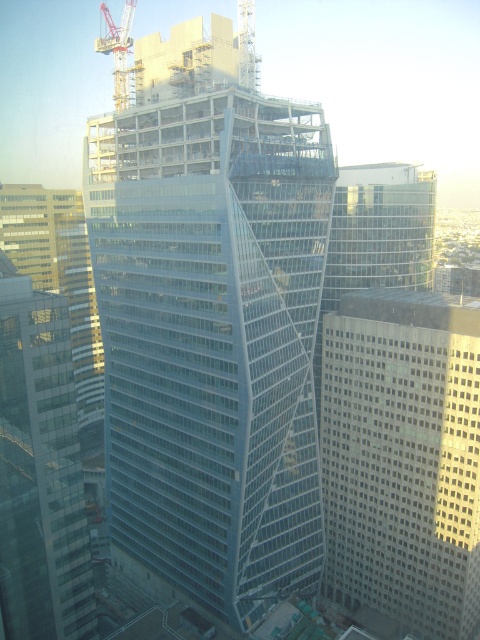
Who is lower down, glassy steel skyscraper at center or metallic yellow crane at upper left?

glassy steel skyscraper at center

The height and width of the screenshot is (640, 480). What do you see at coordinates (212, 333) in the screenshot?
I see `glassy steel skyscraper at center` at bounding box center [212, 333].

This screenshot has height=640, width=480. Identify the location of glassy steel skyscraper at center. (212, 333).

Which is below, clear glass skyscraper at left or metallic yellow crane at upper left?

clear glass skyscraper at left

Is clear glass skyscraper at left shorter than metallic yellow crane at upper left?

Yes, clear glass skyscraper at left is shorter than metallic yellow crane at upper left.

Where is `clear glass skyscraper at left`? clear glass skyscraper at left is located at coordinates (39, 470).

From the picture: Is gray concrete building at center positioned before clear glass skyscraper at left?

No, it is behind clear glass skyscraper at left.

Is gray concrete building at center smaller than clear glass skyscraper at left?

No.

Is point (470, 397) closer to viewer compared to point (4, 465)?

No, (470, 397) is behind (4, 465).

Where is `gray concrete building at center`? The width and height of the screenshot is (480, 640). gray concrete building at center is located at coordinates (403, 458).